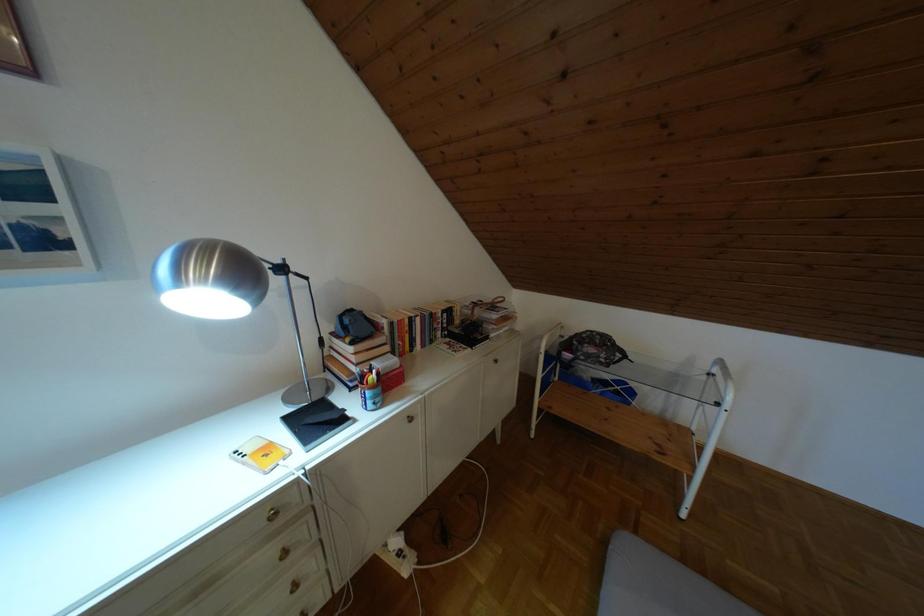
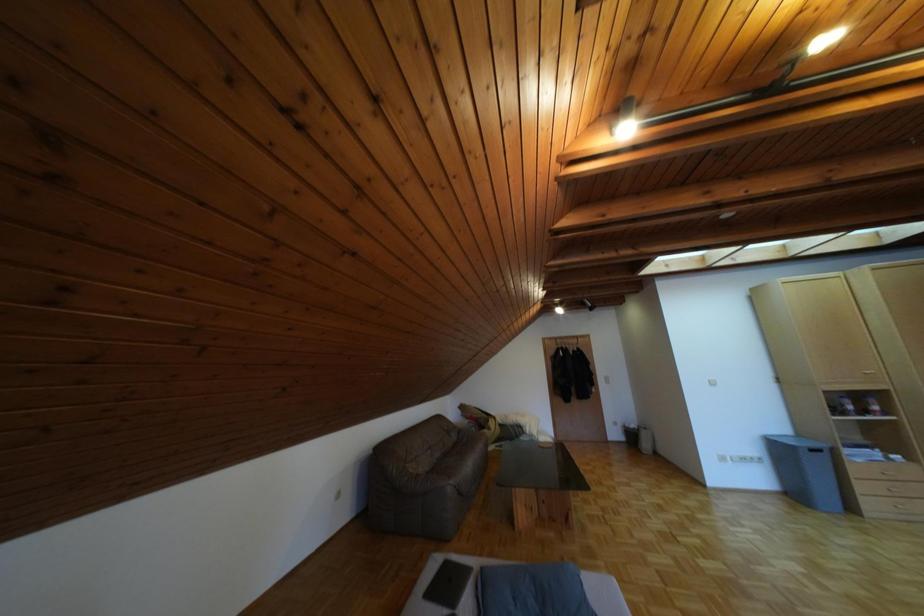
Question: The camera is either moving clockwise (left) or counter-clockwise (right) around the object. The first image is from the beginning of the video and the second image is from the end. Is the camera moving left or right when shooting the video?

Choices:
 (A) Left
 (B) Right

Answer: (A)